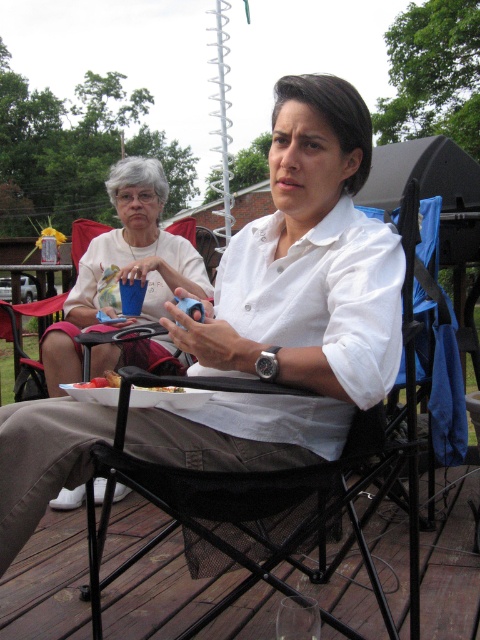
Question: Which of the following is the farthest from the observer?

Choices:
 (A) white matte shirt at upper center
 (B) blue plastic cup at upper center
 (C) brown wood deck at lower left

Answer: (B)

Question: Which of the following is the farthest from the observer?

Choices:
 (A) (160, 284)
 (B) (15, 580)
 (C) (128, 291)

Answer: (A)

Question: Is brown wood deck at lower left to the right of white paper plate at lower center from the viewer's perspective?

Choices:
 (A) no
 (B) yes

Answer: (B)

Question: Is white matte shirt at center to the left of blue plastic cup at upper center from the viewer's perspective?

Choices:
 (A) yes
 (B) no

Answer: (B)

Question: Is blue plastic cup at upper center wider than white paper plate at lower center?

Choices:
 (A) no
 (B) yes

Answer: (B)

Question: Which of these objects is positioned farthest from the brown wood deck at lower left?

Choices:
 (A) blue plastic cup at upper center
 (B) white matte shirt at upper center
 (C) white paper plate at lower center

Answer: (A)